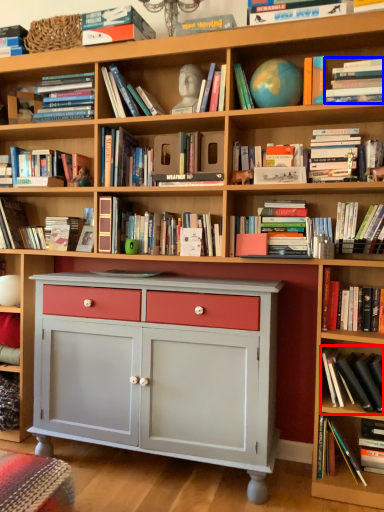
Question: Which object is further to the camera taking this photo, book (highlighted by a red box) or book (highlighted by a blue box)?

Choices:
 (A) book
 (B) book

Answer: (A)